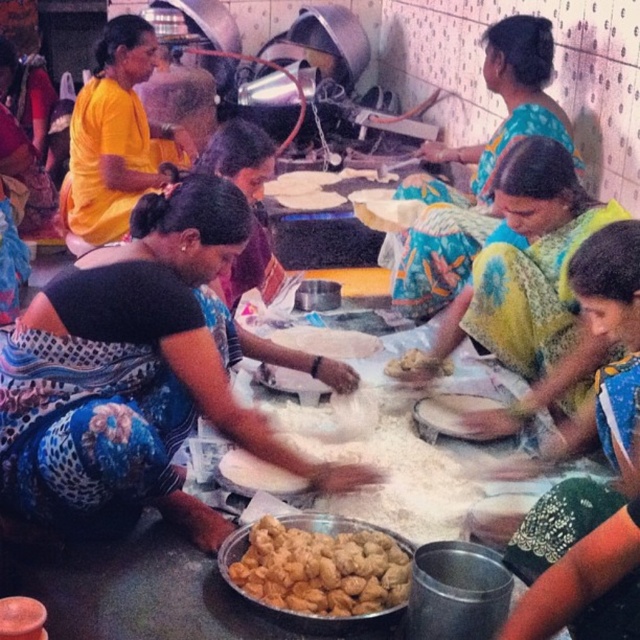
You are a photographer trying to capture the vibrant colors of the women in the scene. You notice two sarees at the center of the image. Which saree is positioned lower between the yellow floral saree at center and the printed cotton saree at center?

The yellow floral saree at center is located below the printed cotton saree at center, so the yellow floral saree at center is positioned lower.

You are standing in the communal kitchen and need to place a new ingredient container on the floor. Where should you place it so that it doesn not interfere with the printed cotton saree at center?

Place the new ingredient container away from the printed cotton saree at center, which is located at coordinates point (476, 168).